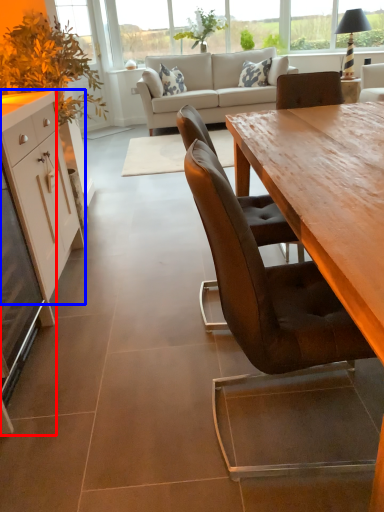
Question: Which object is further to the camera taking this photo, desk (highlighted by a red box) or cabinetry (highlighted by a blue box)?

Choices:
 (A) desk
 (B) cabinetry

Answer: (B)